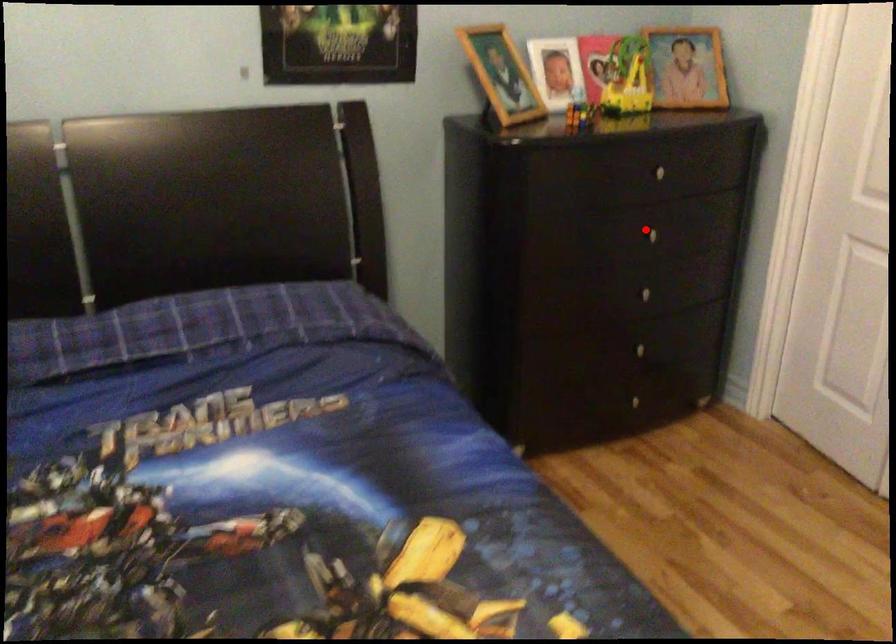
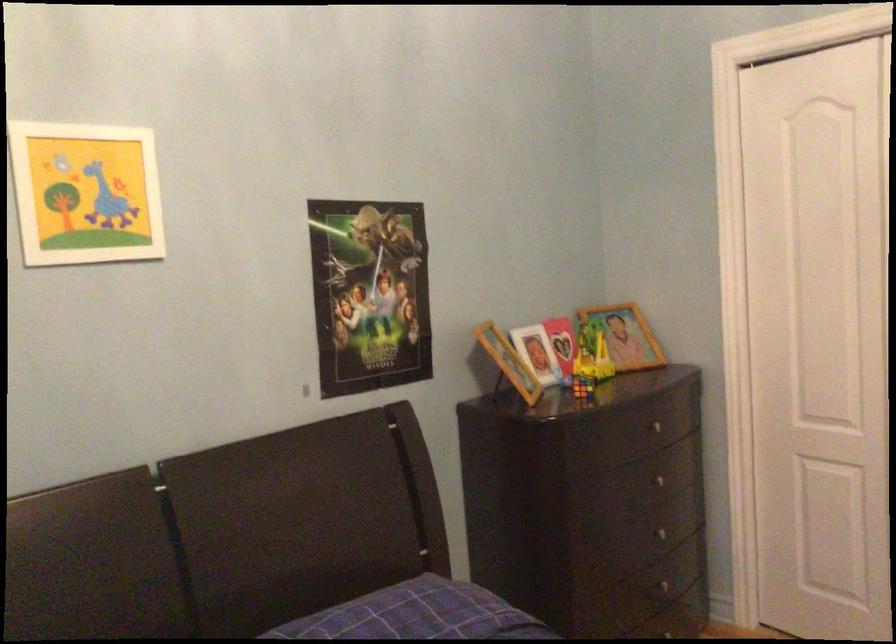
The point at the highlighted location is marked in the first image. Where is the corresponding point in the second image?

(656, 480)